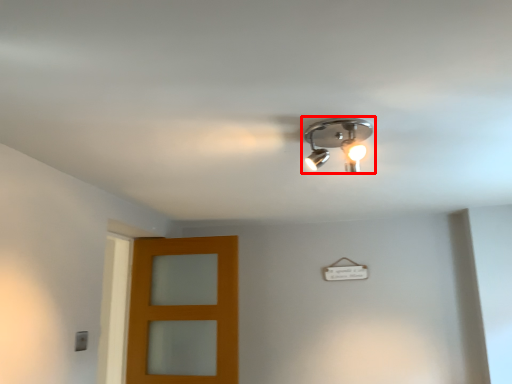
Question: Considering the relative positions of lamp (annotated by the red box) and door in the image provided, where is lamp (annotated by the red box) located with respect to the staircase?

Choices:
 (A) left
 (B) right

Answer: (B)